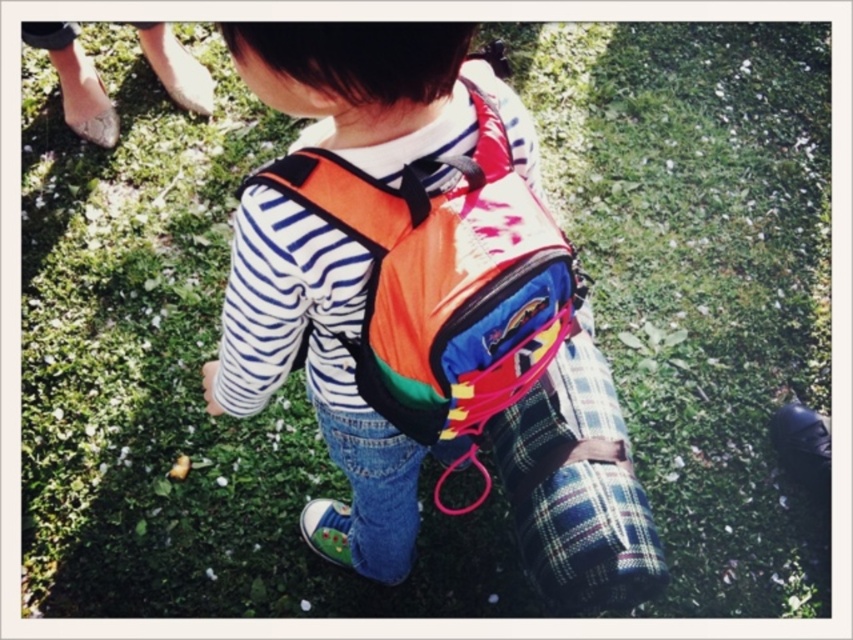
Is point (424, 115) positioned behind point (625, 577)?

No, (424, 115) is closer to viewer.

Between point (447, 179) and point (489, 420), which one is positioned in front?

Point (447, 179) is in front.

Identify the location of matte orange backpack at center. Image resolution: width=853 pixels, height=640 pixels. (387, 262).